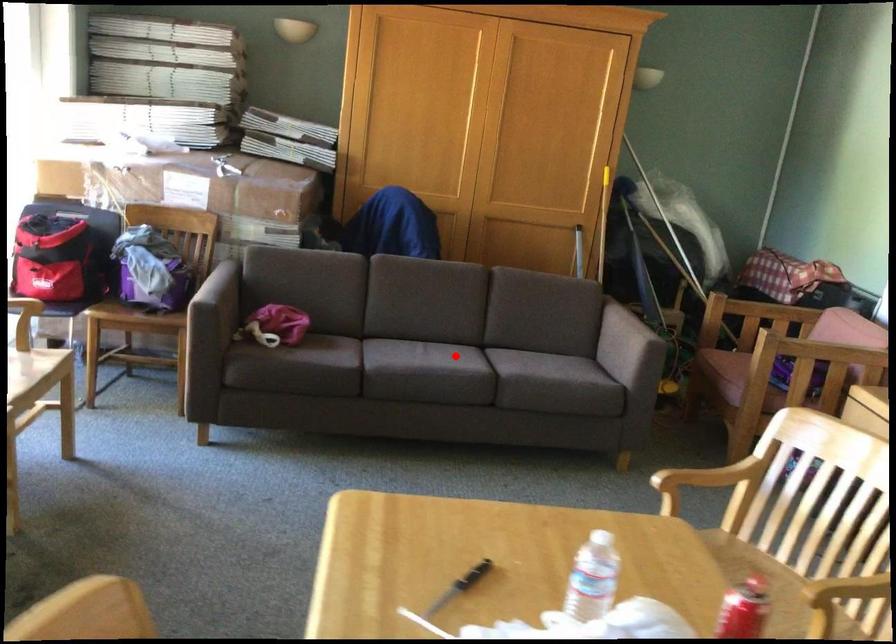
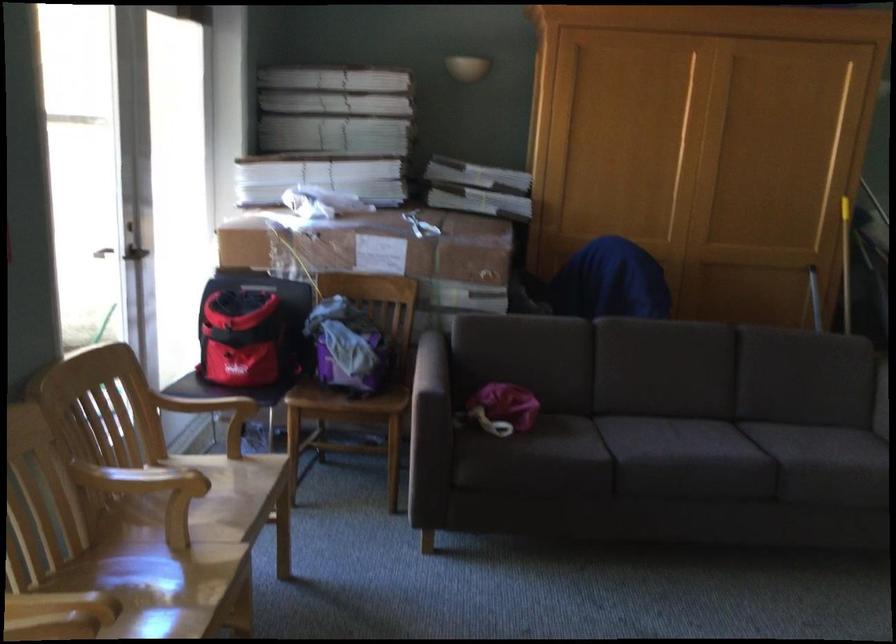
Question: A red point is marked in image1. In image2, is the corresponding 3D point closer to the camera or farther? Reply with the corresponding letter.

Choices:
 (A) The corresponding 3D point is closer.
 (B) The corresponding 3D point is farther.

Answer: (A)